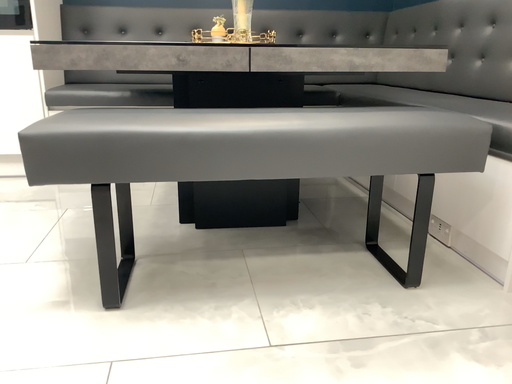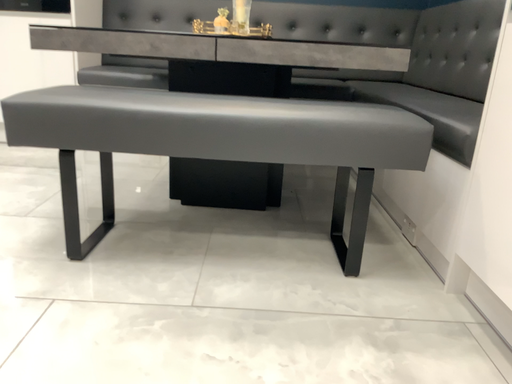
Question: How did the camera likely rotate when shooting the video?

Choices:
 (A) rotated left
 (B) rotated right

Answer: (A)